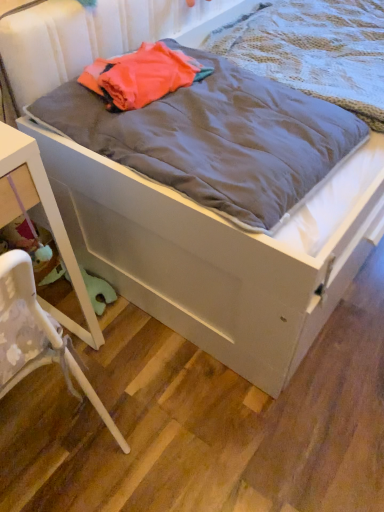
Question: Can you confirm if white glossy nightstand at lower left is taller than gray soft blanket at center, positioned as the 2th blanket in front-to-back order?

Choices:
 (A) no
 (B) yes

Answer: (B)

Question: Can you confirm if white glossy nightstand at lower left is smaller than gray soft blanket at center, positioned as the first blanket in back-to-front order?

Choices:
 (A) no
 (B) yes

Answer: (A)

Question: Is white glossy nightstand at lower left positioned in front of gray soft blanket at center, positioned as the 2th blanket in front-to-back order?

Choices:
 (A) yes
 (B) no

Answer: (A)

Question: Can you confirm if white glossy nightstand at lower left is bigger than gray soft blanket at center, positioned as the first blanket in back-to-front order?

Choices:
 (A) yes
 (B) no

Answer: (A)

Question: From a real-world perspective, is white glossy nightstand at lower left beneath gray soft blanket at center, positioned as the first blanket in back-to-front order?

Choices:
 (A) no
 (B) yes

Answer: (B)

Question: Looking at the image, does white plastic chair at lower left seem bigger or smaller compared to gray soft blanket at center, positioned as the first blanket in back-to-front order?

Choices:
 (A) small
 (B) big

Answer: (B)

Question: From their relative heights in the image, would you say white plastic chair at lower left is taller or shorter than gray soft blanket at center, positioned as the 2th blanket in front-to-back order?

Choices:
 (A) short
 (B) tall

Answer: (B)

Question: Considering the positions of point (59, 344) and point (319, 64), is point (59, 344) closer or farther from the camera than point (319, 64)?

Choices:
 (A) farther
 (B) closer

Answer: (B)

Question: In terms of width, does white plastic chair at lower left look wider or thinner when compared to gray soft blanket at center, positioned as the first blanket in back-to-front order?

Choices:
 (A) thin
 (B) wide

Answer: (A)

Question: Based on their sizes in the image, would you say gray cotton blanket at center, placed as the 2th blanket when sorted from back to front, is bigger or smaller than white glossy nightstand at lower left?

Choices:
 (A) big
 (B) small

Answer: (B)

Question: Looking at their shapes, would you say gray cotton blanket at center, placed as the 2th blanket when sorted from back to front, is wider or thinner than white glossy nightstand at lower left?

Choices:
 (A) thin
 (B) wide

Answer: (B)

Question: Is gray cotton blanket at center, placed as the 2th blanket when sorted from back to front, to the left or to the right of white glossy nightstand at lower left in the image?

Choices:
 (A) left
 (B) right

Answer: (B)

Question: Is gray cotton blanket at center, placed as the 2th blanket when sorted from back to front, spatially inside white glossy nightstand at lower left, or outside of it?

Choices:
 (A) inside
 (B) outside

Answer: (B)

Question: Is point (370, 60) positioned closer to the camera than point (221, 109)?

Choices:
 (A) closer
 (B) farther

Answer: (B)

Question: Looking at the image, does gray soft blanket at center, positioned as the first blanket in back-to-front order, seem bigger or smaller compared to gray cotton blanket at center, placed as the 2th blanket when sorted from back to front?

Choices:
 (A) small
 (B) big

Answer: (B)